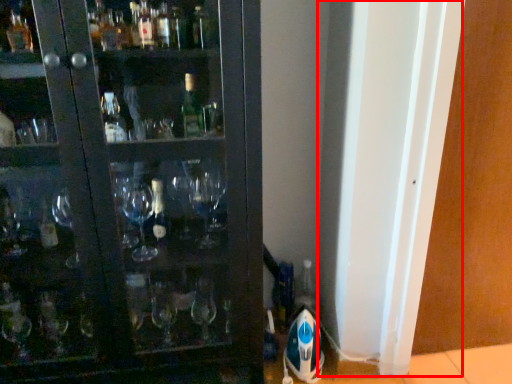
Question: In this image, where is screen door (annotated by the red box) located relative to screen door?

Choices:
 (A) left
 (B) right

Answer: (A)